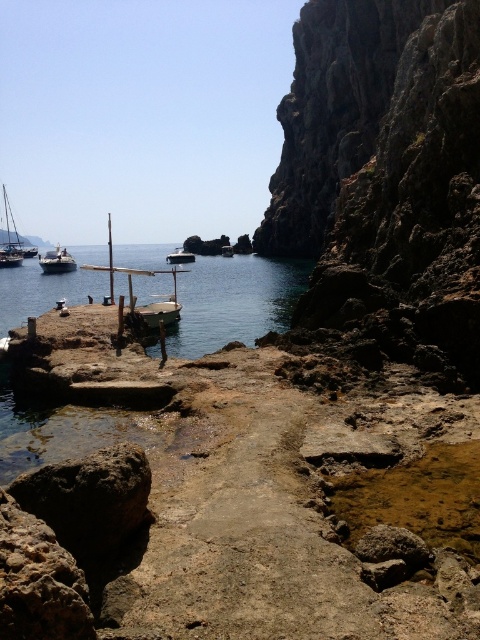
You are a marine biologist planning to transport equipment from the wooden boat at center to the white glossy boat at center. Which boat has a larger deck space for placing equipment?

The white glossy boat at center might have a wider deck space than the wooden boat at center, so it could accommodate more equipment.

You are standing at point A and want to walk to the boat shelter in the middle ground. There are two points marked on the map, point A at coordinates point (178,248) and point B at coordinates point (225,246). Which point should you head towards first to reach the boat shelter?

You should head towards point B at coordinates point (225,246) first because point A at coordinates point (178,248) is located behind point B, meaning point B is closer to your starting position.